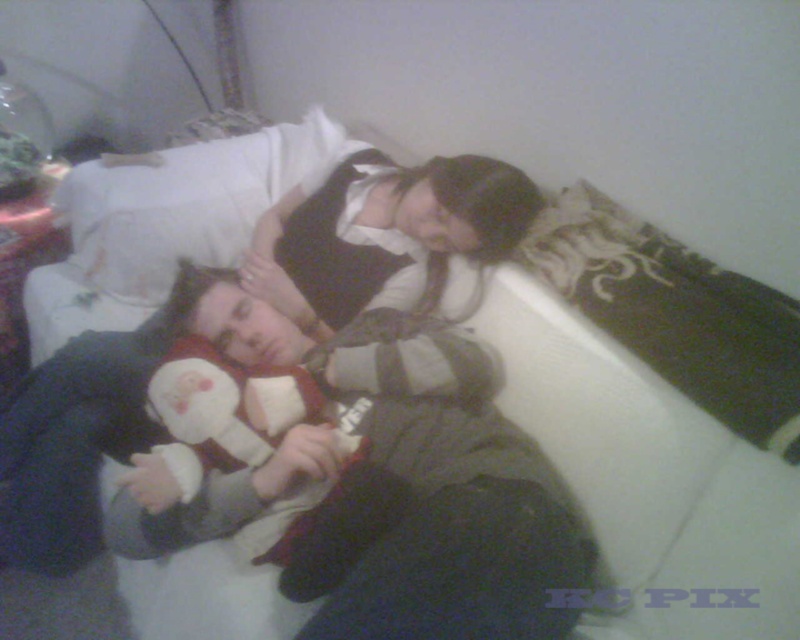
Question: Can you confirm if soft gray sweater at center is positioned to the right of white soft pillow at upper center?

Choices:
 (A) yes
 (B) no

Answer: (A)

Question: Which point appears closest to the camera in this image?

Choices:
 (A) (158, 262)
 (B) (368, 346)

Answer: (B)

Question: Does soft gray sweater at center appear over white soft pillow at upper center?

Choices:
 (A) yes
 (B) no

Answer: (B)

Question: Does soft gray sweater at center appear on the left side of white soft pillow at upper center?

Choices:
 (A) no
 (B) yes

Answer: (A)